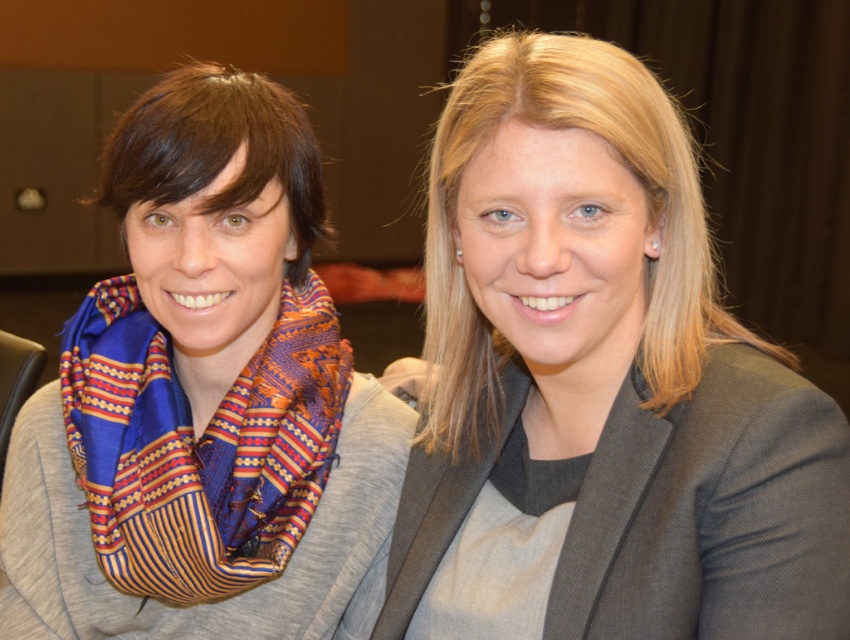
Question: Which object is positioned closest to the matte blue scarf at left?

Choices:
 (A) smooth gray blazer at center
 (B) silky blue and orange scarf at left

Answer: (B)

Question: Where is matte blue scarf at left located in relation to silky blue and orange scarf at left in the image?

Choices:
 (A) left
 (B) right

Answer: (A)

Question: In this image, where is matte blue scarf at left located relative to silky blue and orange scarf at left?

Choices:
 (A) below
 (B) above

Answer: (B)

Question: Considering the relative positions of smooth gray blazer at center and matte blue scarf at left in the image provided, where is smooth gray blazer at center located with respect to matte blue scarf at left?

Choices:
 (A) right
 (B) left

Answer: (A)

Question: Among these points, which one is farthest from the camera?

Choices:
 (A) (677, 563)
 (B) (146, 321)
 (C) (131, 452)

Answer: (B)

Question: Which object appears farthest from the camera in this image?

Choices:
 (A) matte blue scarf at left
 (B) silky blue and orange scarf at left

Answer: (B)